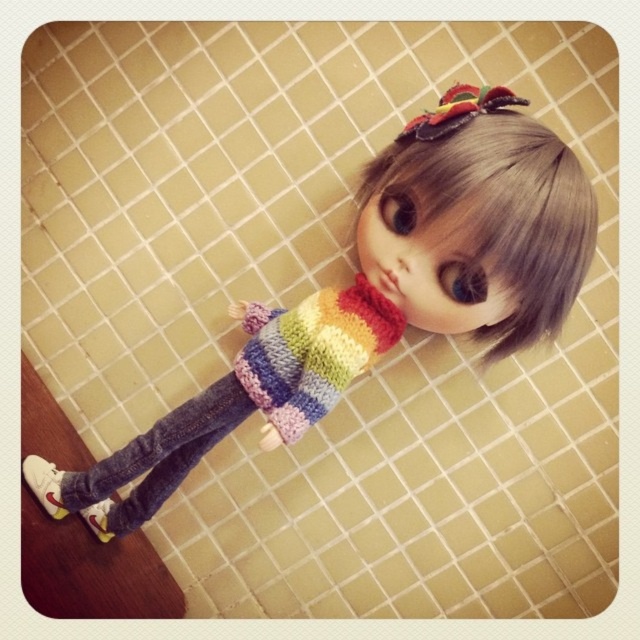
You are an observer looking at the doll in the scene. Which knitted rainbow sweater is positioned lower between the knitted rainbow sweater at upper center and the knitted rainbow sweater at center?

The knitted rainbow sweater at upper center is positioned below the knitted rainbow sweater at center, so the one at upper center is lower.

You are a stylist preparing to dress a mannequin. You have two items to place on the doll shown in the image. The items are the blonde synthetic wig at upper center and the knitted rainbow sweater at center. Which item should you place first if you want to avoid covering the other item?

You should place the knitted rainbow sweater at center first because the blonde synthetic wig at upper center is larger and would cover it if placed afterward.